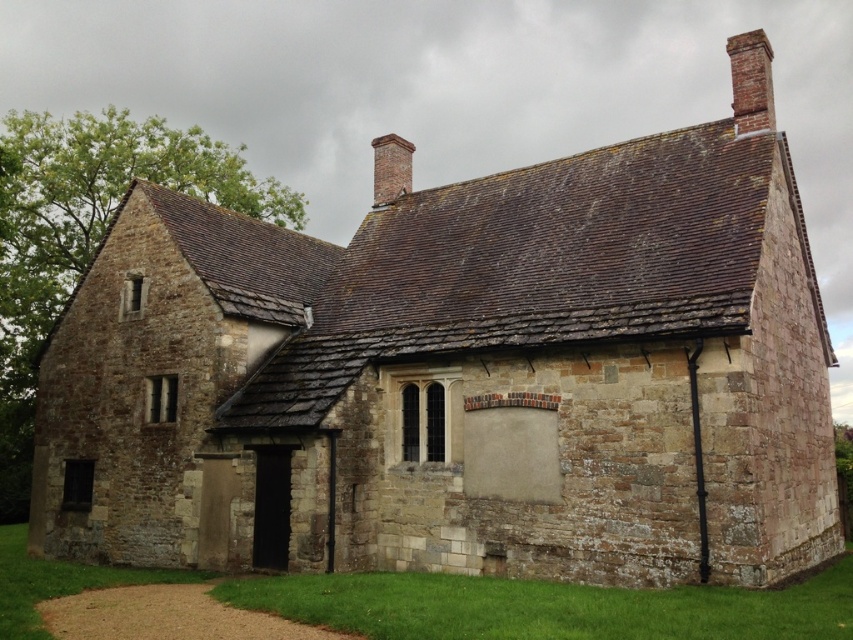
Question: Can you confirm if brick chimney at upper right is wider than brick chimney at upper center?

Choices:
 (A) yes
 (B) no

Answer: (A)

Question: Which object is closer to the camera taking this photo?

Choices:
 (A) brick chimney at upper center
 (B) brick chimney at upper right

Answer: (B)

Question: Does brick chimney at upper right have a greater width compared to brick chimney at upper center?

Choices:
 (A) yes
 (B) no

Answer: (A)

Question: Is brick chimney at upper right to the right of brick chimney at upper center from the viewer's perspective?

Choices:
 (A) yes
 (B) no

Answer: (A)

Question: Which point is closer to the camera?

Choices:
 (A) brick chimney at upper center
 (B) brick chimney at upper right

Answer: (B)